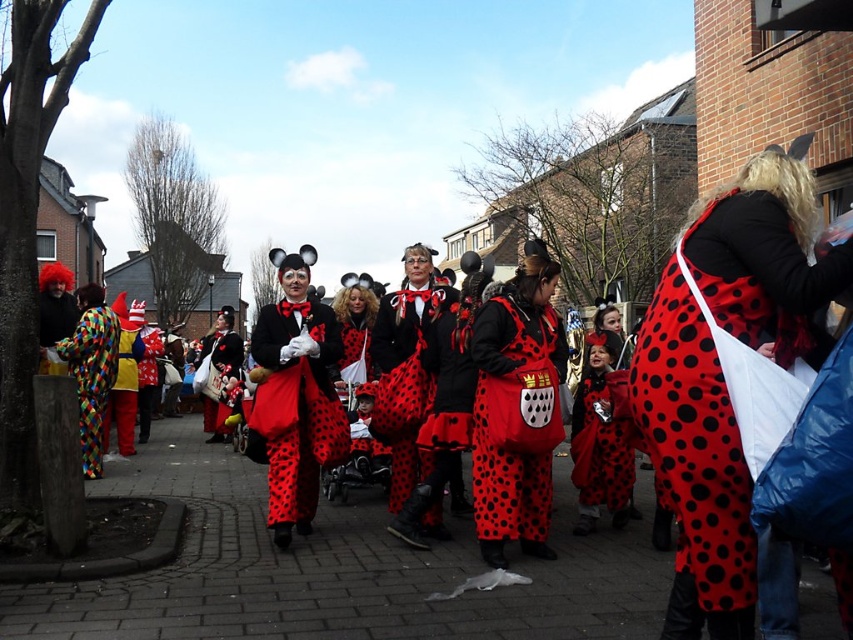
Does point (734, 326) come in front of point (293, 372)?

Yes, point (734, 326) is in front of point (293, 372).

Can you confirm if red dotted fabric dress at center is positioned above matte black coat at center?

Correct, red dotted fabric dress at center is located above matte black coat at center.

Find the location of a particular element. The image size is (853, 640). red dotted fabric dress at center is located at coordinates (694, 465).

Does matte red polka dot costume at center come in front of polka dot fabric dress at center?

Yes.

Can you confirm if matte red polka dot costume at center is shorter than polka dot fabric dress at center?

Yes, matte red polka dot costume at center is shorter than polka dot fabric dress at center.

Does point (154, 616) come farther from viewer compared to point (614, 452)?

No.

The width and height of the screenshot is (853, 640). Find the location of `matte red polka dot costume at center`. matte red polka dot costume at center is located at coordinates (335, 573).

Who is lower down, multicolored fabric clown at left or red dotted fabric at center?

Positioned lower is red dotted fabric at center.

Can you confirm if multicolored fabric clown at left is smaller than red dotted fabric at center?

Correct, multicolored fabric clown at left occupies less space than red dotted fabric at center.

Does point (113, 339) come behind point (204, 342)?

No, (113, 339) is in front of (204, 342).

This screenshot has height=640, width=853. Find the location of `multicolored fabric clown at left`. multicolored fabric clown at left is located at coordinates (91, 376).